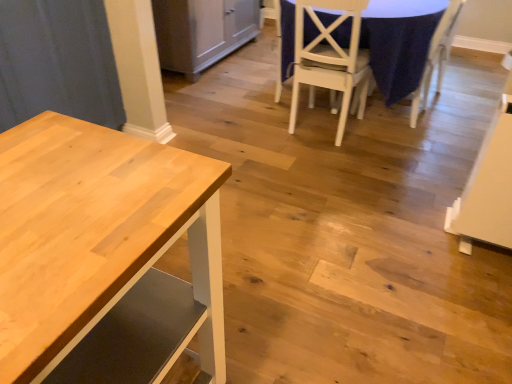
At what (x,y) coordinates should I click in order to perform the action: click on blank space above natural wood table at left (from a real-world perspective). Please return your answer as a coordinate pair (x, y). The width and height of the screenshot is (512, 384). Looking at the image, I should click on (72, 194).